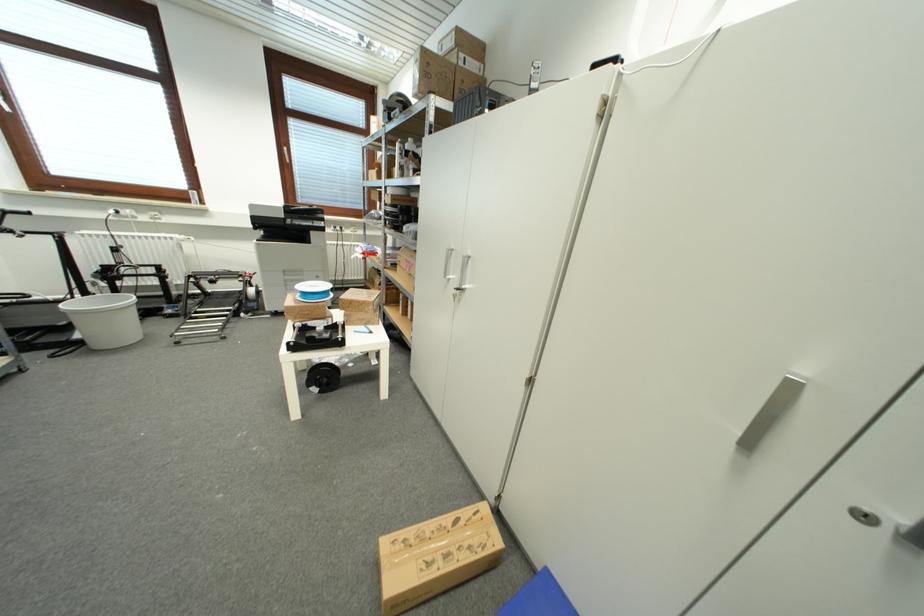
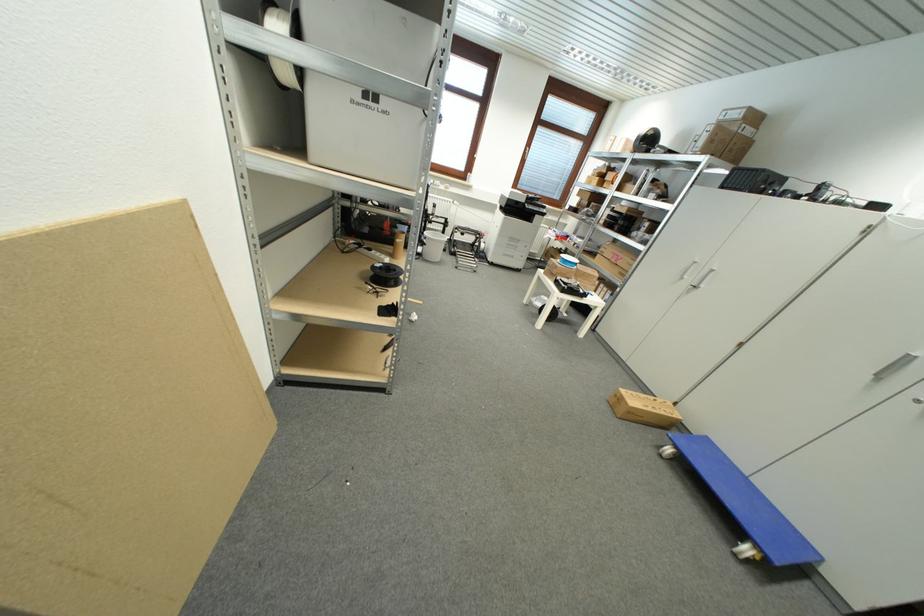
Where in the second image is the point corresponding to the point at 552,575 from the first image?

(711, 440)